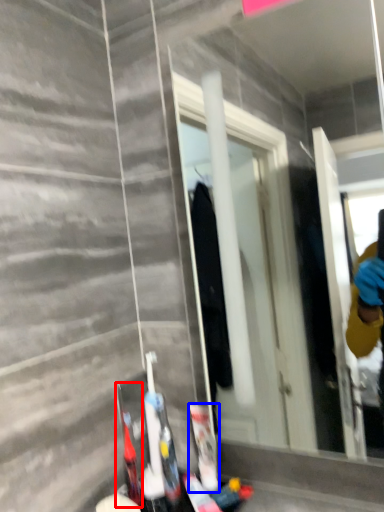
Question: Which of the following is the farthest to the observer, toiletry (highlighted by a red box) or toiletry (highlighted by a blue box)?

Choices:
 (A) toiletry
 (B) toiletry

Answer: (B)